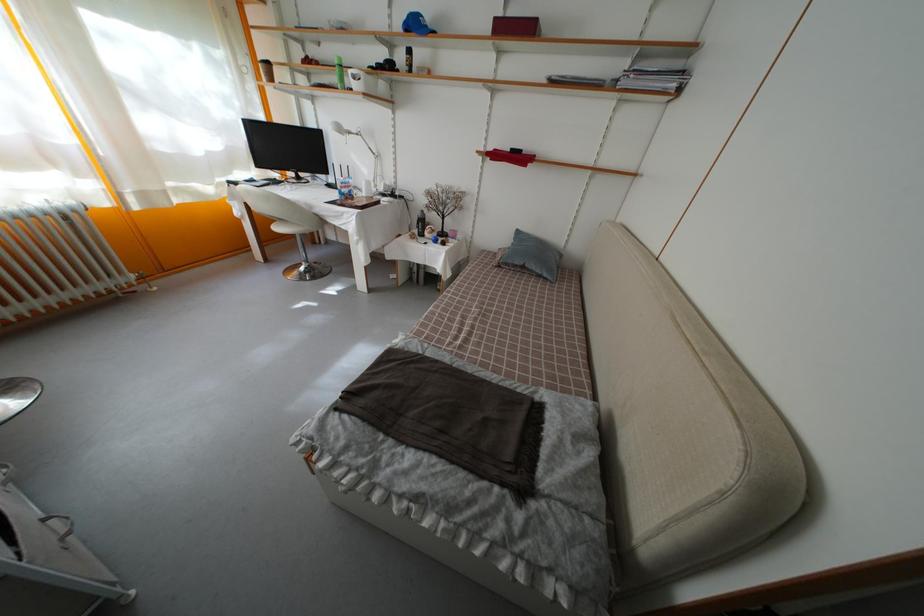
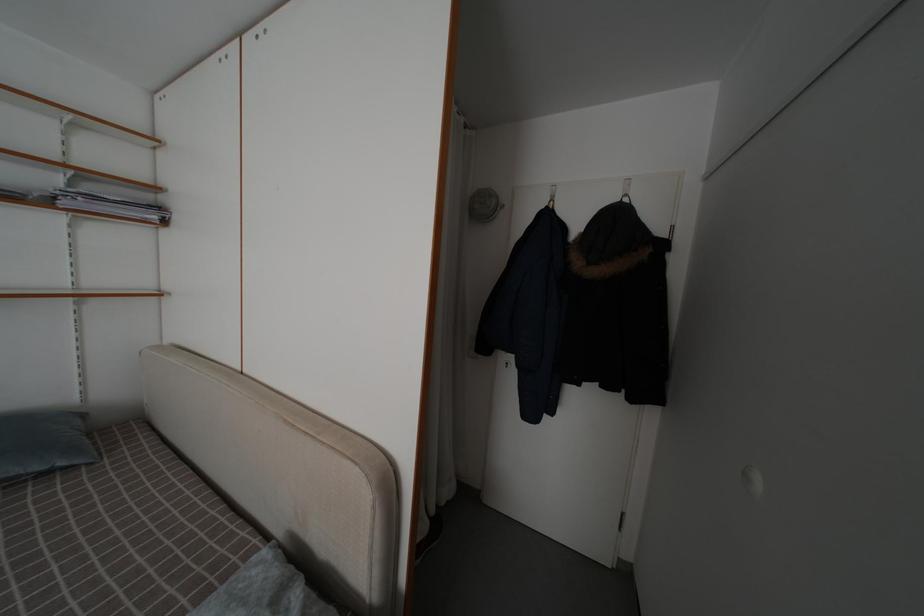
Find the pixel in the second image that matches (x=679, y=92) in the first image.

(161, 224)